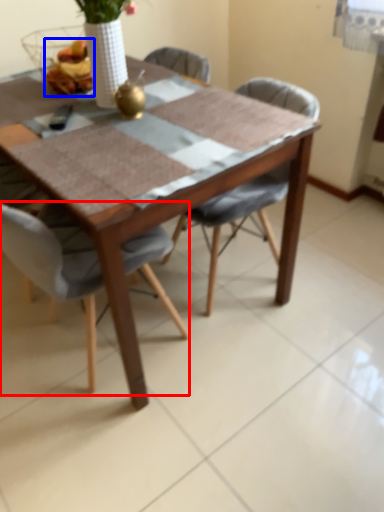
Question: Which object is closer to the camera taking this photo, chair (highlighted by a red box) or food (highlighted by a blue box)?

Choices:
 (A) chair
 (B) food

Answer: (A)